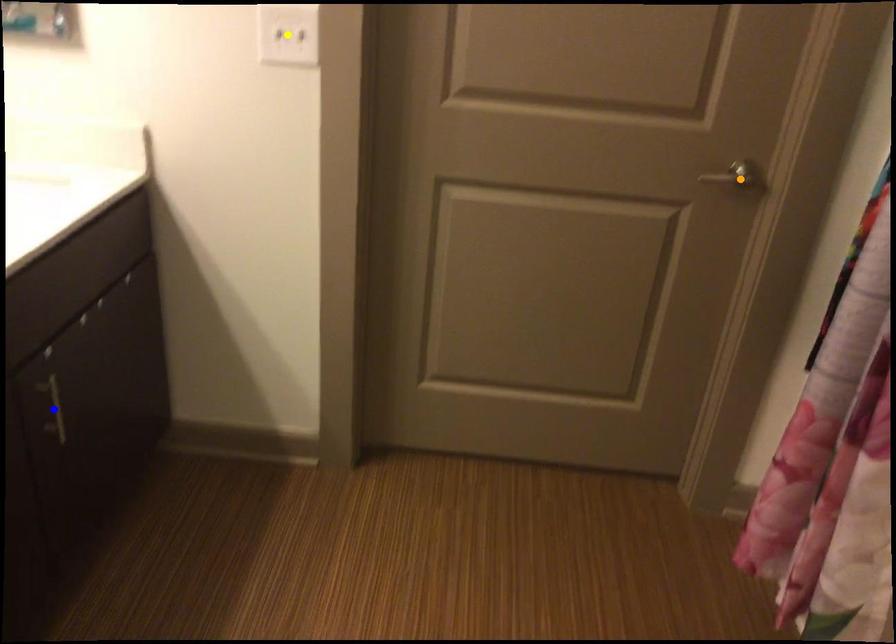
Based on the photo, order these from nearest to farthest:
A) orange point
B) yellow point
C) blue point

blue point, yellow point, orange point